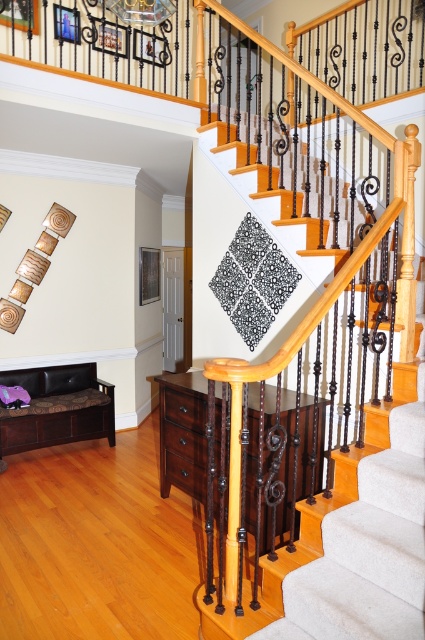
Question: Does white carpeted stairs at upper center have a larger size compared to brown leather bench at lower left?

Choices:
 (A) yes
 (B) no

Answer: (A)

Question: Among these objects, which one is nearest to the camera?

Choices:
 (A) brown leather bench at lower left
 (B) white carpeted stairs at upper center

Answer: (B)

Question: In this image, where is white carpeted stairs at upper center located relative to brown leather bench at lower left?

Choices:
 (A) right
 (B) left

Answer: (A)

Question: Which object is farther from the camera taking this photo?

Choices:
 (A) white carpeted stairs at upper center
 (B) brown leather bench at lower left

Answer: (B)

Question: Can you confirm if white carpeted stairs at upper center is thinner than brown leather bench at lower left?

Choices:
 (A) no
 (B) yes

Answer: (A)